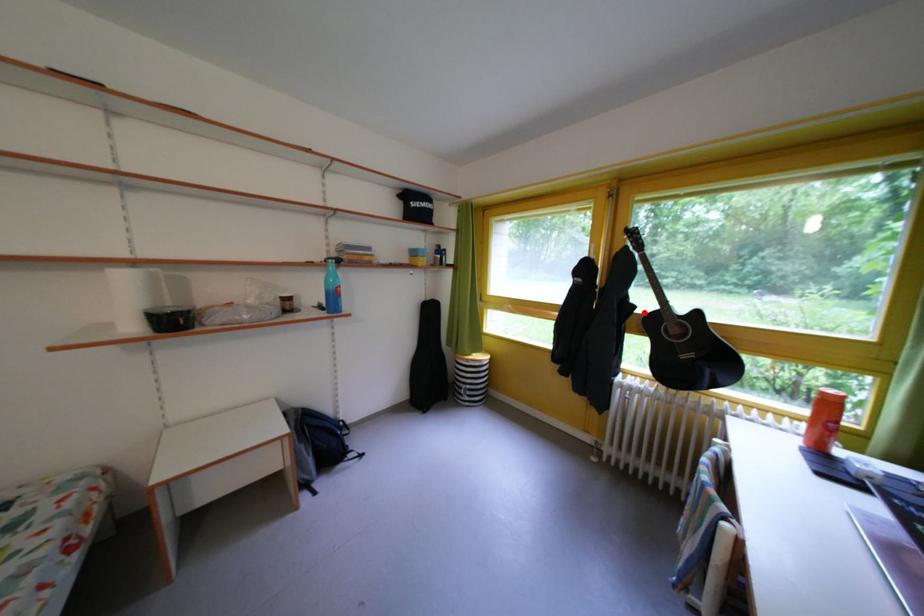
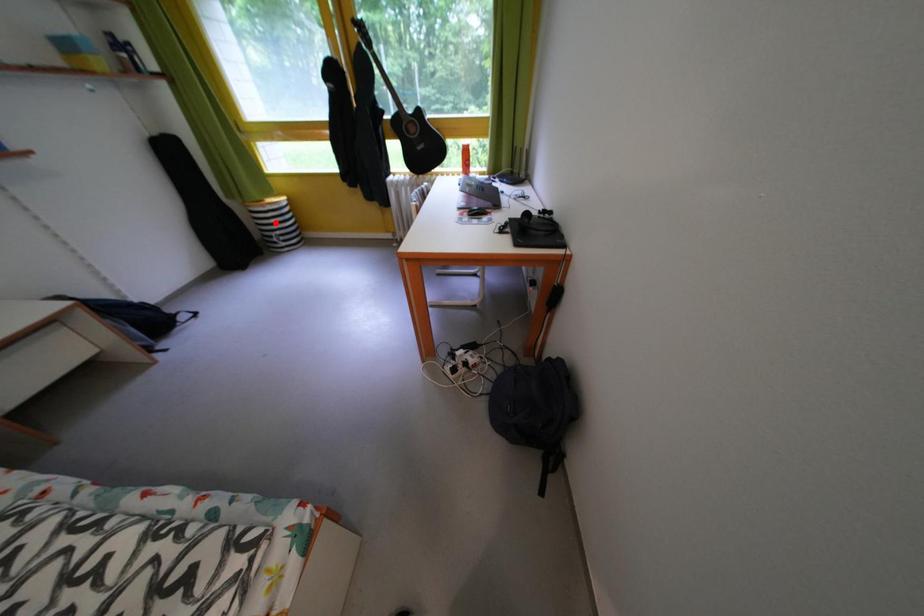
I am providing you with two images of the same scene from different viewpoints. A red point is marked on the first image and another point is marked on the second image. Is the red point in image1 aligned with the point shown in image2?

No